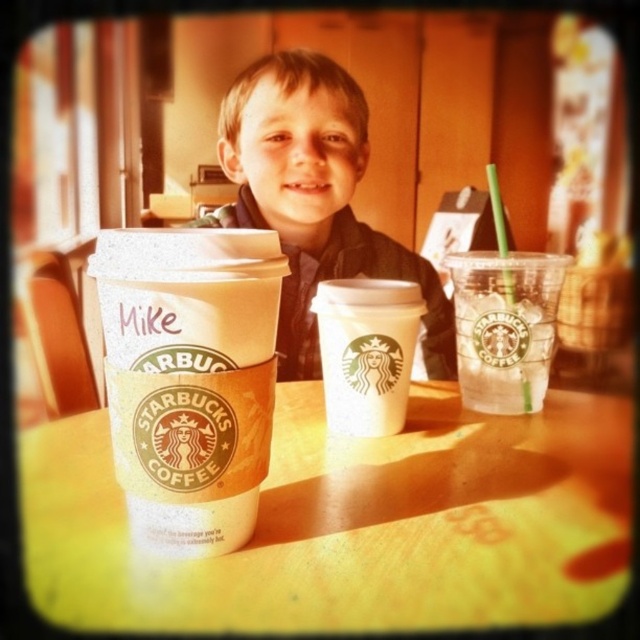
Question: Is matte black jacket at center above white paper cup at center?

Choices:
 (A) yes
 (B) no

Answer: (A)

Question: Based on their relative distances, which object is farther from the clear plastic cup at center right?

Choices:
 (A) yellow matte table at center
 (B) matte black jacket at center
 (C) white paper cup at left

Answer: (B)

Question: Based on their relative distances, which object is nearer to the matte black jacket at center?

Choices:
 (A) clear plastic cup at center right
 (B) yellow matte table at center

Answer: (A)

Question: Can you confirm if matte black jacket at center is positioned to the left of white paper cup at center?

Choices:
 (A) yes
 (B) no

Answer: (A)

Question: Among these points, which one is nearest to the camera?

Choices:
 (A) (278, 436)
 (B) (97, 292)
 (C) (496, 294)

Answer: (A)

Question: Does yellow matte table at center have a larger size compared to clear plastic cup at center right?

Choices:
 (A) yes
 (B) no

Answer: (A)